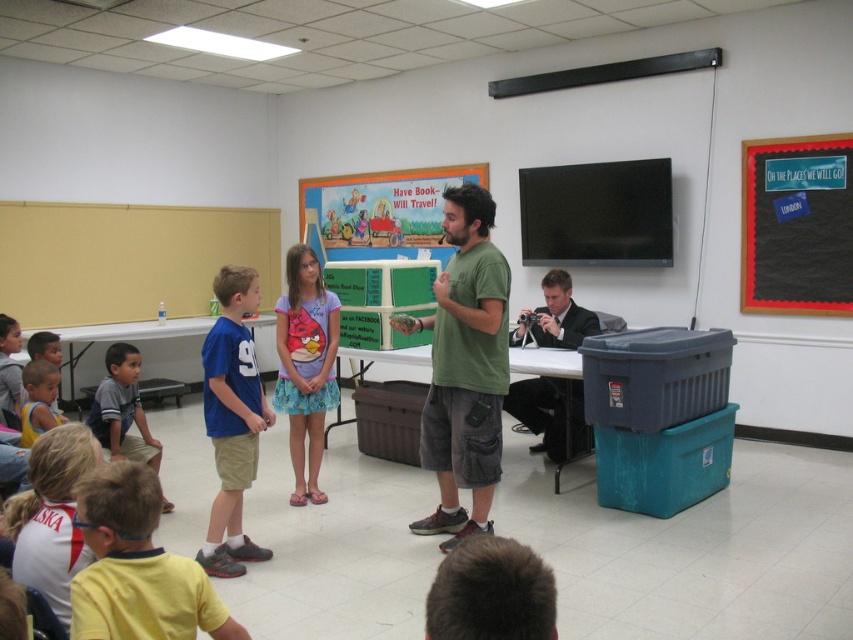
Who is taller, green cotton shirt at center or black suit at right?

green cotton shirt at center

Which is in front, point (490, 216) or point (532, 412)?

Point (490, 216)

Is point (480, 426) closer to camera compared to point (544, 449)?

Yes, point (480, 426) is closer to viewer.

The width and height of the screenshot is (853, 640). Identify the location of green cotton shirt at center. (465, 368).

Who is positioned more to the right, black chalkboard at upper right or gray cotton shirt at lower left?

Positioned to the right is black chalkboard at upper right.

Is black chalkboard at upper right wider than gray cotton shirt at lower left?

Indeed, black chalkboard at upper right has a greater width compared to gray cotton shirt at lower left.

Who is more forward, (846, 241) or (126, 346)?

Positioned in front is point (126, 346).

Where is `black chalkboard at upper right`? This screenshot has height=640, width=853. black chalkboard at upper right is located at coordinates (796, 225).

Is point (848, 195) farther from camera compared to point (549, 288)?

That is True.

Is the position of black chalkboard at upper right more distant than that of black suit at right?

Yes, it is.

At what (x,y) coordinates should I click in order to perform the action: click on black chalkboard at upper right. Please return your answer as a coordinate pair (x, y). Image resolution: width=853 pixels, height=640 pixels. Looking at the image, I should click on click(796, 225).

You are a GUI agent. You are given a task and a screenshot of the screen. Output one action in this format:
    pyautogui.click(x=<x>, y=<y>)
    Task: Click on the black chalkboard at upper right
    
    Given the screenshot: What is the action you would take?
    pyautogui.click(x=796, y=225)